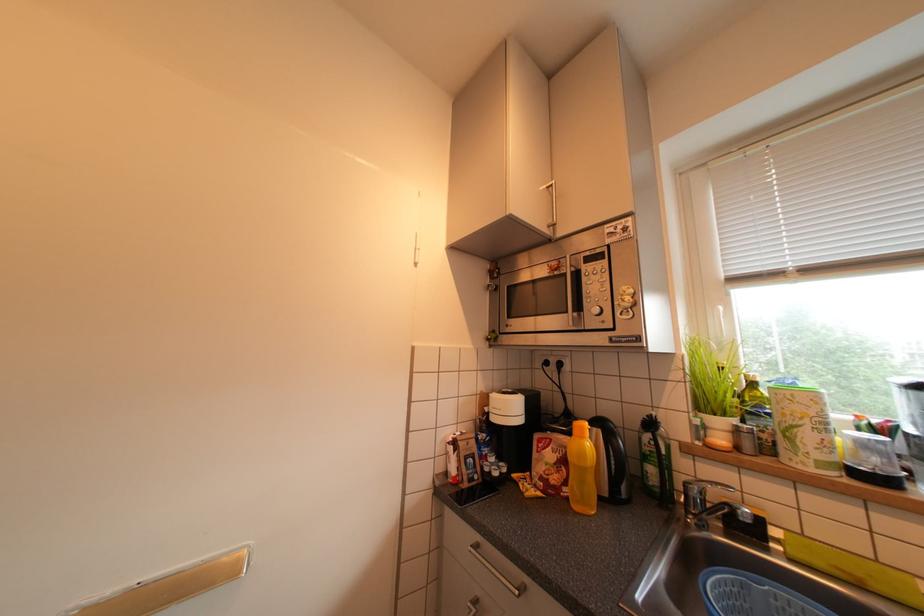
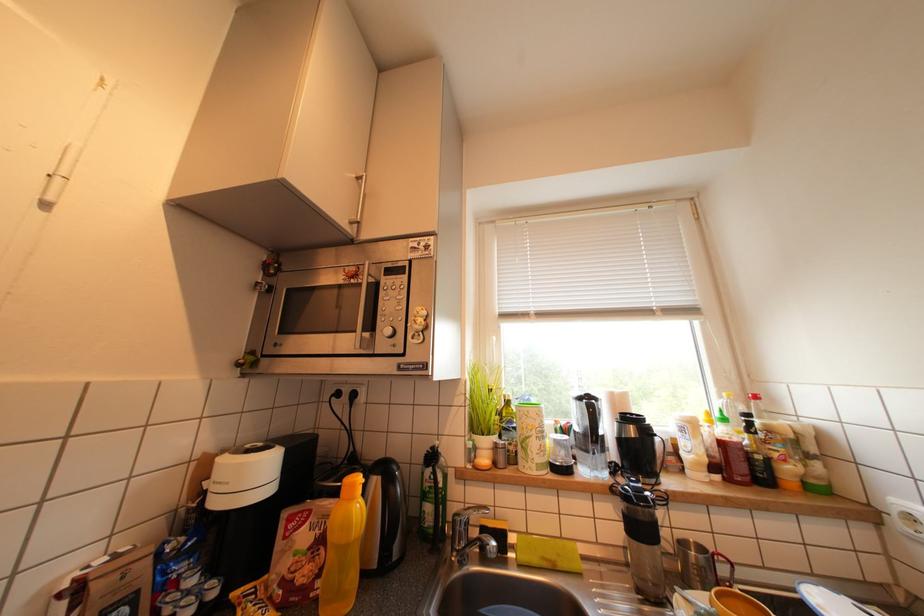
Question: The first image is from the beginning of the video and the second image is from the end. How did the camera likely rotate when shooting the video?

Choices:
 (A) Left
 (B) Right
 (C) Up
 (D) Down

Answer: (B)